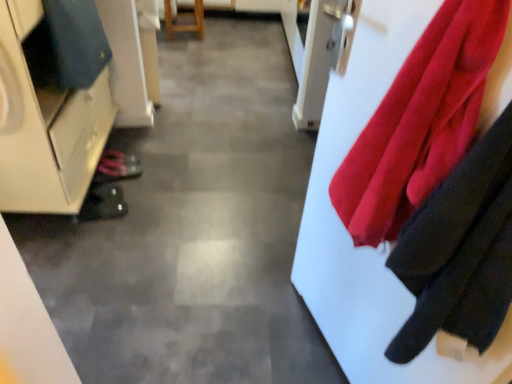
Identify the location of free area behind shiny black shoe at lower left, the second shoe from the bottom. The width and height of the screenshot is (512, 384). (141, 149).